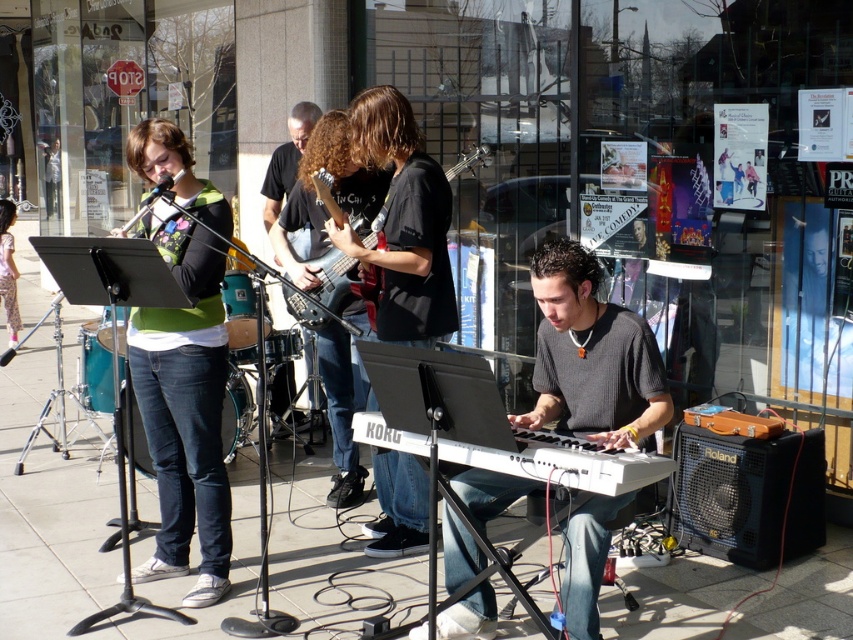
You are a street performer who needs to decide which item to carry first between the gray knitted sweater at center and the metallic electric guitar at center. Based on their sizes, which one should you choose to carry first?

The gray knitted sweater at center has a larger size compared to the metallic electric guitar at center, so you should carry the gray knitted sweater at center first as it requires more space.

You are a photographer trying to capture the band members in the scene. You notice the black cotton shirt at center and the white plastic keyboard at center. Which object should you focus on first if you want to prioritize the taller one?

The black cotton shirt at center is taller than the white plastic keyboard at center, so you should focus on the black cotton shirt at center first.